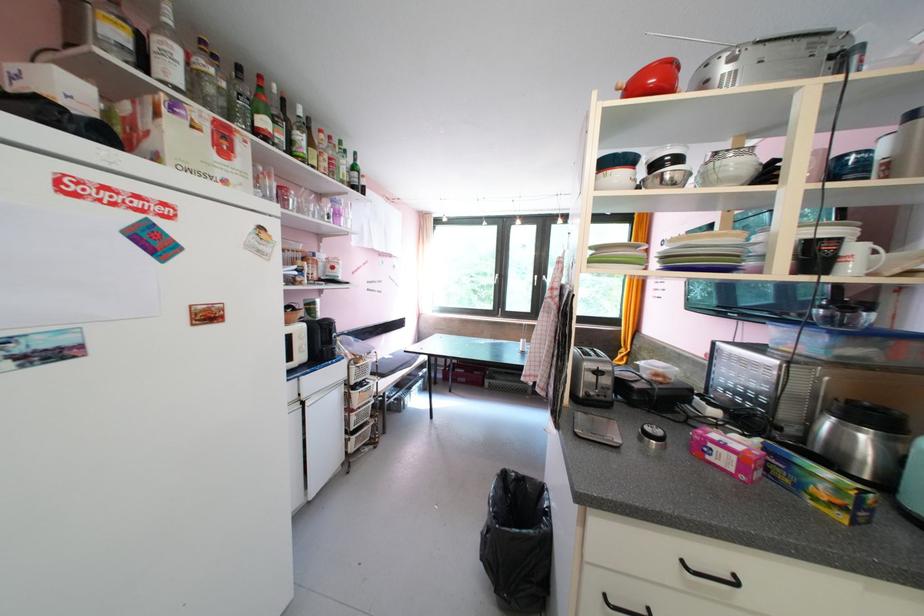
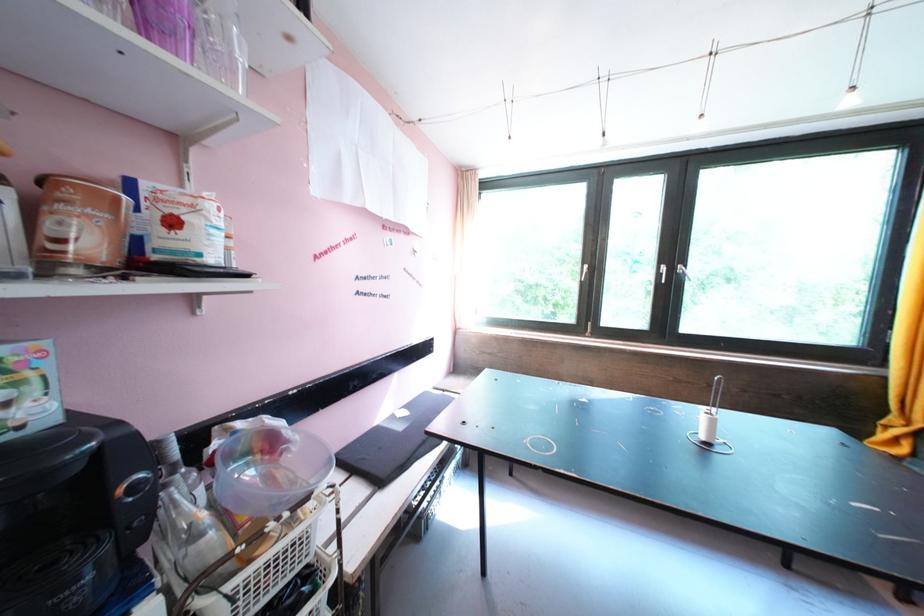
Find the pixel in the second image that matches the point at 342,270 in the first image.

(181, 225)